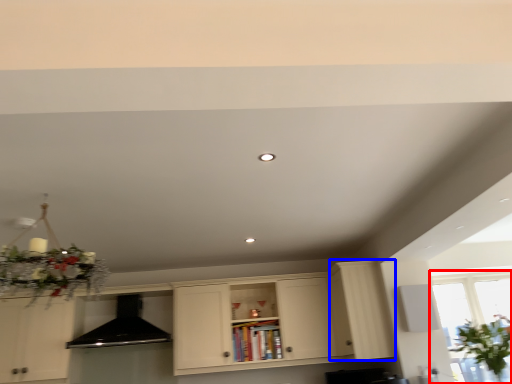
Question: Which object appears closest to the camera in this image, window (highlighted by a red box) or cabinetry (highlighted by a blue box)?

Choices:
 (A) window
 (B) cabinetry

Answer: (A)